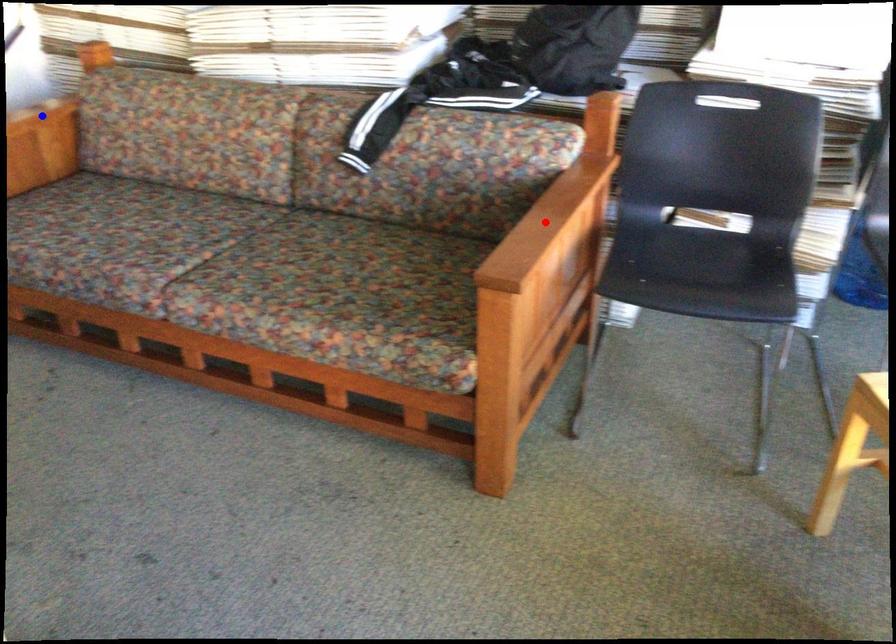
Question: Two points are marked on the image. Which point is closer to the camera?

Choices:
 (A) Blue point is closer.
 (B) Red point is closer.

Answer: (B)